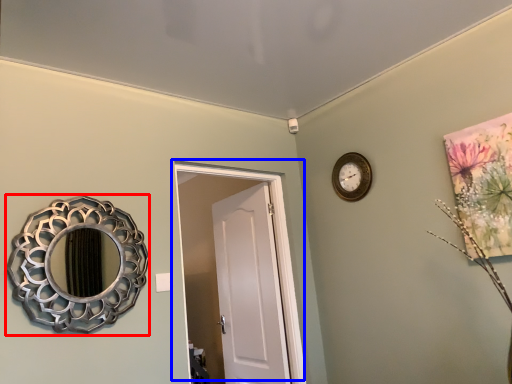
Question: Among these objects, which one is farthest to the camera, mirror (highlighted by a red box) or door (highlighted by a blue box)?

Choices:
 (A) mirror
 (B) door

Answer: (B)